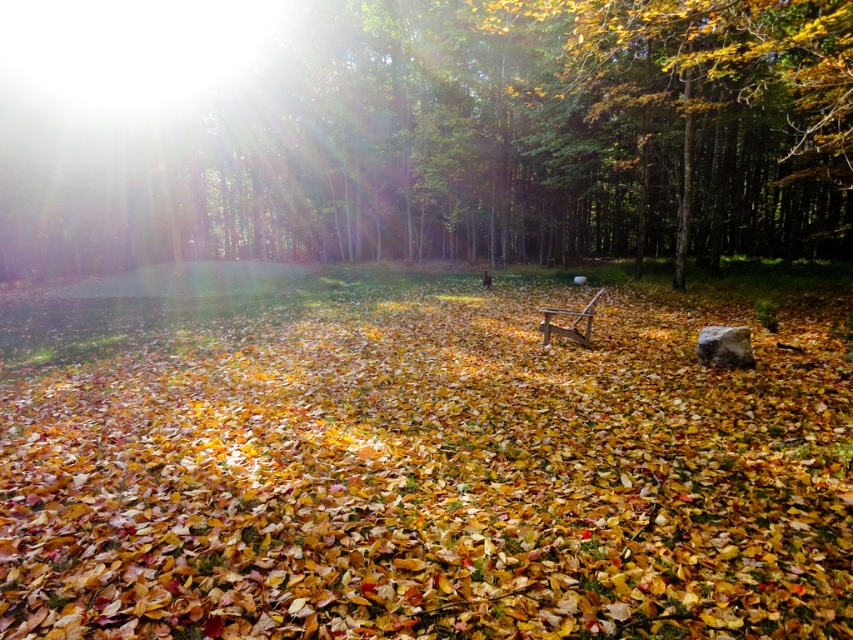
Who is taller, multicolored leaf litter at center or green matte tree at center?

green matte tree at center

Can you confirm if multicolored leaf litter at center is positioned above green matte tree at center?

No.

The width and height of the screenshot is (853, 640). I want to click on multicolored leaf litter at center, so click(432, 477).

The height and width of the screenshot is (640, 853). In order to click on multicolored leaf litter at center in this screenshot , I will do `click(432, 477)`.

Which of these two, multicolored leaf litter at center or wooden bench at center, stands taller?

With more height is multicolored leaf litter at center.

Does multicolored leaf litter at center come behind wooden bench at center?

No.

Find the location of a particular element. multicolored leaf litter at center is located at coordinates (432, 477).

Which is more to the right, green matte tree at center or wooden bench at center?

wooden bench at center

Does point (190, 168) come closer to viewer compared to point (567, 332)?

No, it is not.

Between point (795, 230) and point (596, 292), which one is positioned in front?

Point (596, 292)

Image resolution: width=853 pixels, height=640 pixels. In order to click on green matte tree at center in this screenshot , I will do `click(422, 131)`.